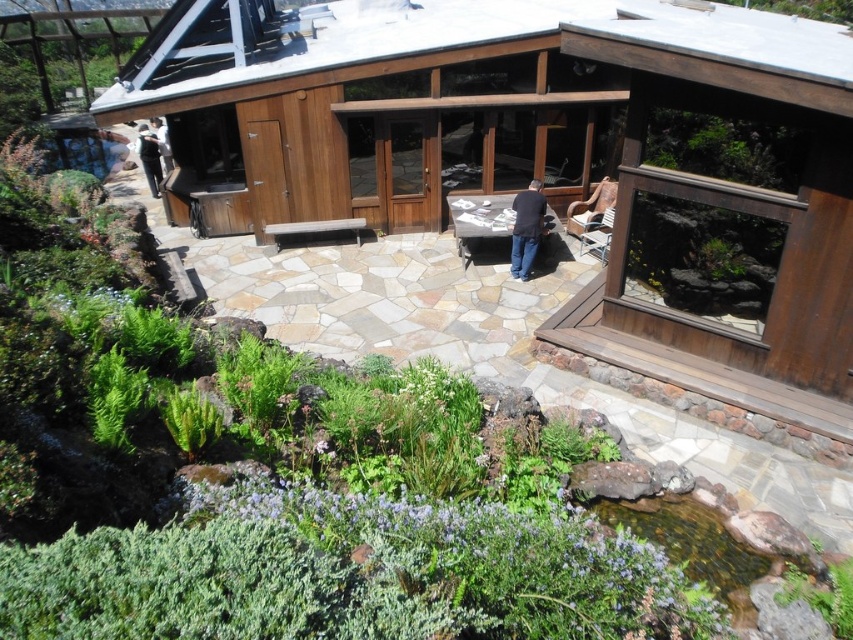
You are standing on the stone patio and see the green leafy plants at lower left and the green mossy rock at lower left. Which of these two objects is positioned to the right of the other?

The green leafy plants at lower left are to the right of the green mossy rock at lower left.

You are standing on the stone patio and want to place a 5 meter long wooden bench between the green mossy rock at lower left and the dark blue jeans at left. Is there enough space?

The distance between the green mossy rock at lower left and dark blue jeans at left is 4.55 meters. Since the bench is 5 meters long, it won

You are designing a garden layout and need to place a small decorative item between the green mossy rock at lower left and the dark blue jeans at left. Which object should the item be placed closer to if you want it to be near the larger object?

The green mossy rock at lower left is bigger than the dark blue jeans at left, so the item should be placed closer to the green mossy rock at lower left to be near the larger object.